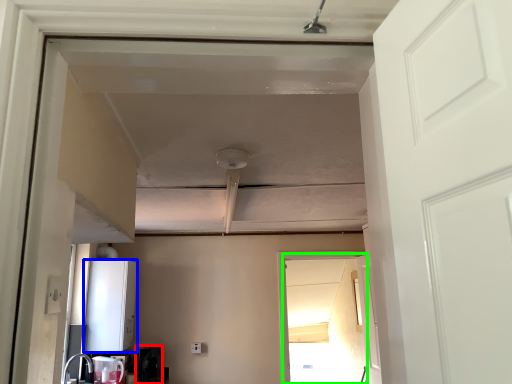
Question: Which object is positioned closest to appliance (highlighted by a red box)? Select from appliance (highlighted by a blue box) and screen door (highlighted by a green box).

Choices:
 (A) appliance
 (B) screen door

Answer: (A)